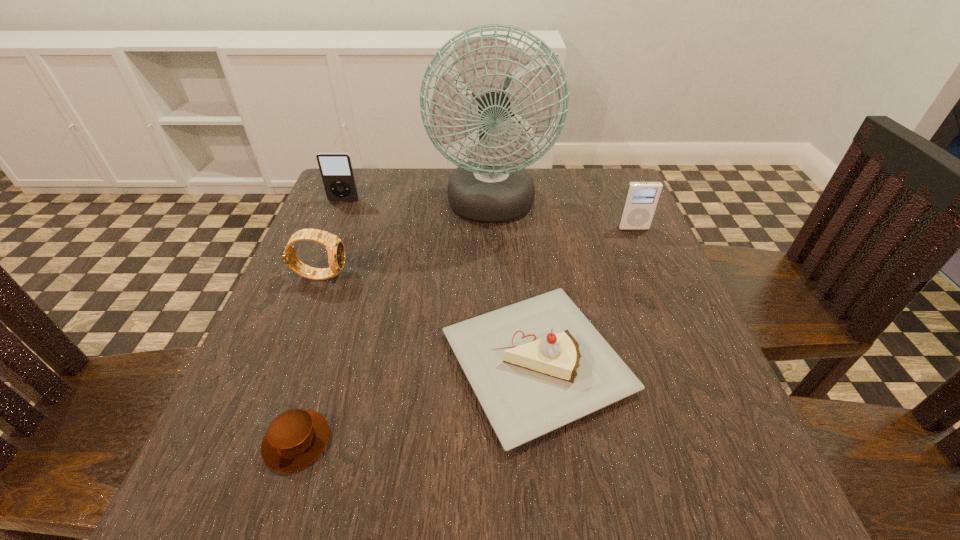
Where is `vacant space positioned on the face of the third nearest object`? vacant space positioned on the face of the third nearest object is located at coordinates (381, 274).

The image size is (960, 540). What are the coordinates of `vacant area situated 0.130m on the back of the second shortest object` in the screenshot? It's located at (524, 253).

Identify the location of vacant space located 0.250m on the back of the shortest object. This screenshot has height=540, width=960. (343, 296).

Locate an element on the screen. fan that is positioned at the far edge is located at coordinates (495, 187).

This screenshot has height=540, width=960. I want to click on iPod that is at the far edge, so click(336, 169).

Find the location of `cake positioned at the near edge`. cake positioned at the near edge is located at coordinates (537, 365).

In order to click on muffin present at the near edge in this screenshot , I will do `click(296, 438)`.

Identify the location of iPod at the left edge. (336, 169).

I want to click on watch that is at the left edge, so click(335, 248).

Where is `muffin situated at the left edge`? muffin situated at the left edge is located at coordinates (296, 438).